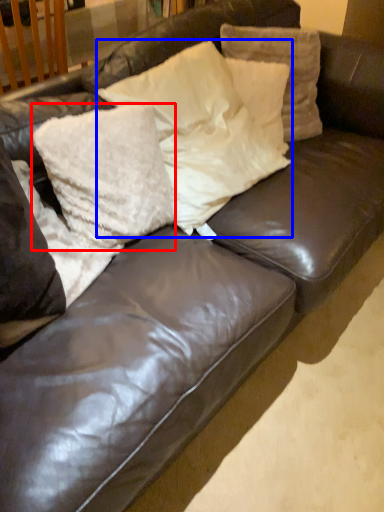
Question: Which of the following is the farthest to the observer, pillow (highlighted by a red box) or pillow (highlighted by a blue box)?

Choices:
 (A) pillow
 (B) pillow

Answer: (B)